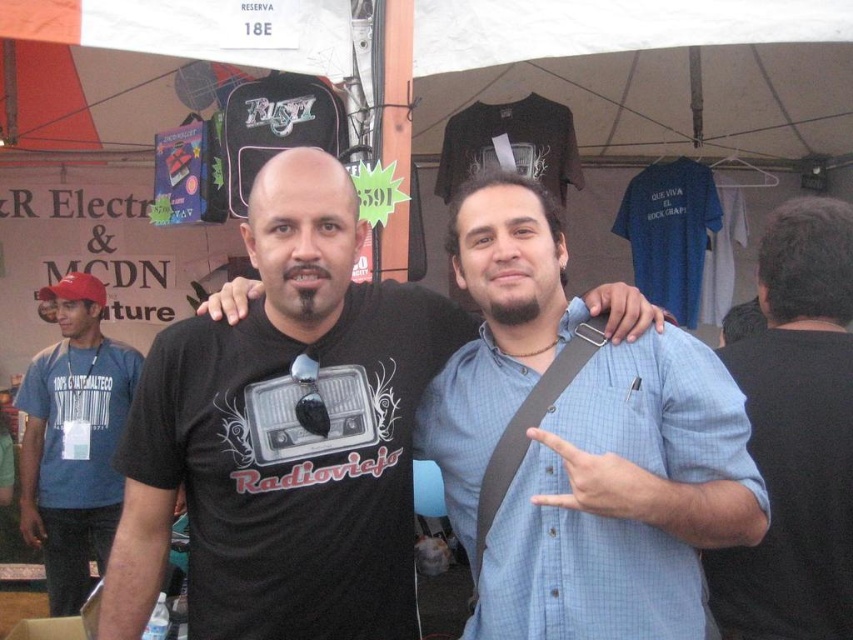
Question: From the image, what is the correct spatial relationship of black matte t-shirt at center in relation to blue cotton t-shirt at left?

Choices:
 (A) left
 (B) right

Answer: (B)

Question: Is black matte t-shirt at center positioned before light blue button-down shirt at center?

Choices:
 (A) no
 (B) yes

Answer: (A)

Question: Does black matte t-shirt at center have a smaller size compared to light blue button-down shirt at center?

Choices:
 (A) yes
 (B) no

Answer: (B)

Question: Which point is farther to the camera?

Choices:
 (A) light blue button-down shirt at center
 (B) dark gray shirt at right

Answer: (B)

Question: Which object appears farthest from the camera in this image?

Choices:
 (A) black matte t-shirt at center
 (B) dark gray shirt at right
 (C) blue cotton t-shirt at left

Answer: (C)

Question: Which of the following is the farthest from the observer?

Choices:
 (A) dark gray shirt at right
 (B) black matte t-shirt at center
 (C) light blue button-down shirt at center

Answer: (A)